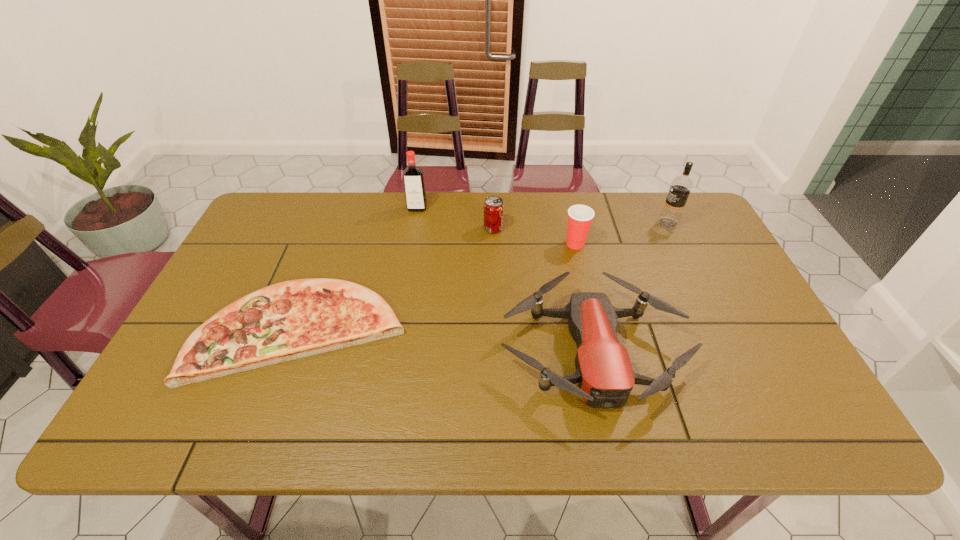
The width and height of the screenshot is (960, 540). What are the coordinates of `empty location between the fourth farthest object and the nearer vodka` in the screenshot? It's located at (621, 233).

Locate an element on the screen. This screenshot has width=960, height=540. free space between the rightmost object and the left vodka is located at coordinates (542, 216).

Locate an element on the screen. empty space between the third nearest object and the right vodka is located at coordinates (621, 233).

Locate which object ranks third in proximity to the nearer vodka. Please provide its 2D coordinates. Your answer should be formatted as a tuple, i.e. [(x, y)], where the tuple contains the x and y coordinates of a point satisfying the conditions above.

[(493, 215)]

Select which object appears as the third closest to the fourth farthest object. Please provide its 2D coordinates. Your answer should be formatted as a tuple, i.e. [(x, y)], where the tuple contains the x and y coordinates of a point satisfying the conditions above.

[(681, 186)]

At what (x,y) coordinates should I click in order to perform the action: click on vacant space that satisfies the following two spatial constraints: 1. on the label of the right vodka; 2. on the front side of the shortest object. Please return your answer as a coordinate pair (x, y). This screenshot has width=960, height=540. Looking at the image, I should click on (719, 330).

This screenshot has height=540, width=960. I want to click on vacant space that satisfies the following two spatial constraints: 1. on the front and back of the Dixie cup; 2. on the right side of the left vodka, so click(x=411, y=244).